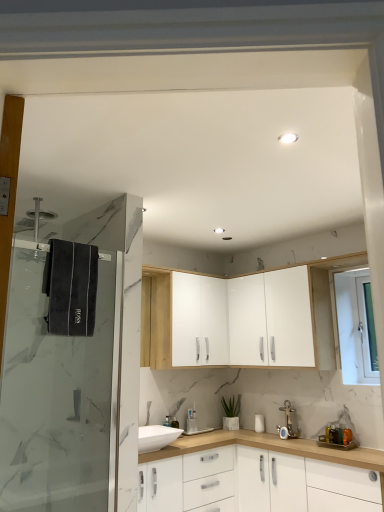
What is the approximate height of white plastic window screen at upper right?

The height of white plastic window screen at upper right is 32.03 inches.

At what (x,y) coordinates should I click in order to perform the action: click on white plastic window screen at upper right. Please return your answer as a coordinate pair (x, y). Image resolution: width=384 pixels, height=512 pixels. Looking at the image, I should click on (367, 328).

I want to click on dark grey towel at left, so click(71, 288).

This screenshot has width=384, height=512. What do you see at coordinates (71, 288) in the screenshot?
I see `dark grey towel at left` at bounding box center [71, 288].

Identify the location of white glossy light fixture at upper center. (288, 138).

Identify the location of white matte cabinet at center, which is counted as the first cabinetry, starting from the bottom. The height and width of the screenshot is (512, 384). (309, 474).

What do you see at coordinates (231, 406) in the screenshot?
I see `green matte plant at lower center` at bounding box center [231, 406].

I want to click on white plastic window screen at upper right, so click(367, 328).

Can you confirm if white glossy light fixture at upper center is bigger than dark grey towel at left?

No.

From a real-world perspective, is white glossy light fixture at upper center physically below dark grey towel at left?

No, from a real-world perspective, white glossy light fixture at upper center is not below dark grey towel at left.

Considering their positions, is white glossy light fixture at upper center located in front of or behind dark grey towel at left?

white glossy light fixture at upper center is in front of dark grey towel at left.

From the image's perspective, between transparent glass shower door at left and white glossy light fixture at upper center, which one is located above?

From the image's view, white glossy light fixture at upper center is above.

Considering the positions of point (131, 253) and point (284, 139), is point (131, 253) closer or farther from the camera than point (284, 139)?

Point (131, 253) is farther from the camera than point (284, 139).

Are transparent glass shower door at left and white glossy light fixture at upper center far apart?

Indeed, transparent glass shower door at left is not near white glossy light fixture at upper center.

How many degrees apart are the facing directions of transparent glass shower door at left and white glossy light fixture at upper center?

The facing directions of transparent glass shower door at left and white glossy light fixture at upper center are 176 degrees apart.

Does white glossy cabinet at center, the 1th cabinetry in the top-to-bottom sequence, have a lesser width compared to white glossy cabinet at upper center, positioned as the 2th cabinetry in top-to-bottom order?

In fact, white glossy cabinet at center, the 1th cabinetry in the top-to-bottom sequence, might be wider than white glossy cabinet at upper center, positioned as the 2th cabinetry in top-to-bottom order.

Is white glossy cabinet at center, the 1th cabinetry in the top-to-bottom sequence, positioned beyond the bounds of white glossy cabinet at upper center, positioned as the 2th cabinetry in top-to-bottom order?

Yes.

Is point (296, 306) farther from camera compared to point (223, 282)?

No, (296, 306) is closer to viewer.

Considering the relative sizes of white glossy cabinet at center, the 1th cabinetry in the top-to-bottom sequence, and white glossy cabinet at upper center, placed as the second cabinetry when sorted from bottom to top, in the image provided, is white glossy cabinet at center, the 1th cabinetry in the top-to-bottom sequence, shorter than white glossy cabinet at upper center, placed as the second cabinetry when sorted from bottom to top,?

Yes, white glossy cabinet at center, the 1th cabinetry in the top-to-bottom sequence, is shorter than white glossy cabinet at upper center, placed as the second cabinetry when sorted from bottom to top.

How many degrees apart are the facing directions of white matte cabinet at center, which is counted as the first cabinetry, starting from the bottom, and white plastic window screen at upper right?

0.0219 degrees separate the facing orientations of white matte cabinet at center, which is counted as the first cabinetry, starting from the bottom, and white plastic window screen at upper right.

Which is closer to the camera, (320, 487) or (372, 378)?

The point (320, 487) is more forward.

Considering the sizes of objects white matte cabinet at center, which is counted as the first cabinetry, starting from the bottom, and white plastic window screen at upper right in the image provided, who is taller, white matte cabinet at center, which is counted as the first cabinetry, starting from the bottom, or white plastic window screen at upper right?

white plastic window screen at upper right.

From a real-world perspective, between white matte cabinet at center, acting as the 3th cabinetry starting from the top, and white plastic window screen at upper right, who is vertically lower?

white matte cabinet at center, acting as the 3th cabinetry starting from the top, from a real-world perspective.

Based on the photo, between gold metallic faucet at lower right and white glossy cabinet at center, which is the 3th cabinetry in bottom-to-top order, which one appears on the left side from the viewer's perspective?

From the viewer's perspective, white glossy cabinet at center, which is the 3th cabinetry in bottom-to-top order, appears more on the left side.

Based on the photo, is gold metallic faucet at lower right positioned with its back to white glossy cabinet at center, which is the 3th cabinetry in bottom-to-top order?

No, white glossy cabinet at center, which is the 3th cabinetry in bottom-to-top order, is not at the back of gold metallic faucet at lower right.

Between gold metallic faucet at lower right and white glossy cabinet at center, which is the 3th cabinetry in bottom-to-top order, which one has smaller size?

gold metallic faucet at lower right.

Would you say gold metallic faucet at lower right is a long distance from white glossy cabinet at center, the 1th cabinetry in the top-to-bottom sequence?

gold metallic faucet at lower right is near white glossy cabinet at center, the 1th cabinetry in the top-to-bottom sequence, not far away.

From the image's perspective, which one is positioned higher, white glossy door at upper right or white matte cabinet at center, which is counted as the first cabinetry, starting from the bottom?

white glossy door at upper right is shown above in the image.

Does white glossy door at upper right have a greater height compared to white matte cabinet at center, acting as the 3th cabinetry starting from the top?

Yes.

Considering the positions of objects white glossy door at upper right and white matte cabinet at center, which is counted as the first cabinetry, starting from the bottom, in the image provided, who is more to the right, white glossy door at upper right or white matte cabinet at center, which is counted as the first cabinetry, starting from the bottom,?

white glossy door at upper right is more to the right.

Does white glossy door at upper right turn towards white matte cabinet at center, which is counted as the first cabinetry, starting from the bottom?

No.

From a real-world perspective, which object rests below the other?

In real-world perspective, white matte cabinet at center, acting as the 3th cabinetry starting from the top, is lower.

Is white glossy light fixture at upper center inside white matte cabinet at center, acting as the 3th cabinetry starting from the top?

Definitely not — white glossy light fixture at upper center is not inside white matte cabinet at center, acting as the 3th cabinetry starting from the top.

At what (x,y) coordinates should I click in order to perform the action: click on light fixture on the right of dark grey towel at left. Please return your answer as a coordinate pair (x, y). The width and height of the screenshot is (384, 512). Looking at the image, I should click on (288, 138).

Identify the location of light fixture behind the transparent glass shower door at left. This screenshot has height=512, width=384. (288, 138).

Which object lies further to the anchor point white glossy cabinet at upper center, placed as the second cabinetry when sorted from bottom to top, white glossy light fixture at upper center or white glossy door at upper right?

The object further to white glossy cabinet at upper center, placed as the second cabinetry when sorted from bottom to top, is white glossy light fixture at upper center.

Looking at the image, which one is located closer to white glossy door at upper right, dark grey towel at left or white plastic window screen at upper right?

Based on the image, white plastic window screen at upper right appears to be nearer to white glossy door at upper right.

Considering their positions, is white matte cabinet at center, which is counted as the first cabinetry, starting from the bottom, positioned closer to white plastic window screen at upper right than white glossy cabinet at center, which is the 3th cabinetry in bottom-to-top order?

Based on the image, white glossy cabinet at center, which is the 3th cabinetry in bottom-to-top order, appears to be nearer to white plastic window screen at upper right.

From the image, which object appears to be nearer to white matte cabinet at center, which is counted as the first cabinetry, starting from the bottom, gold metallic faucet at lower right or dark grey towel at left?

Among the two, gold metallic faucet at lower right is located nearer to white matte cabinet at center, which is counted as the first cabinetry, starting from the bottom.

From the image, which object appears to be farther from dark grey towel at left, transparent glass shower door at left or white glossy cabinet at center, which is the 3th cabinetry in bottom-to-top order?

white glossy cabinet at center, which is the 3th cabinetry in bottom-to-top order, is positioned further to the anchor dark grey towel at left.

Consider the image. Based on their spatial positions, is white plastic window screen at upper right or white glossy cabinet at upper center, positioned as the 2th cabinetry in top-to-bottom order, further from white matte cabinet at center, which is counted as the first cabinetry, starting from the bottom?

white plastic window screen at upper right lies further to white matte cabinet at center, which is counted as the first cabinetry, starting from the bottom, than the other object.

Consider the image. Looking at the image, which one is located further to dark grey towel at left, transparent glass shower door at left or gold metallic faucet at lower right?

gold metallic faucet at lower right is positioned further to the anchor dark grey towel at left.

Considering their positions, is white glossy cabinet at center, which is the 3th cabinetry in bottom-to-top order, positioned closer to white glossy light fixture at upper center than gold metallic faucet at lower right?

The object closer to white glossy light fixture at upper center is white glossy cabinet at center, which is the 3th cabinetry in bottom-to-top order.

Locate an element on the screen. The height and width of the screenshot is (512, 384). tap between white glossy door at upper right and white matte cabinet at center, which is counted as the first cabinetry, starting from the bottom, vertically is located at coordinates (290, 420).

At what (x,y) coordinates should I click in order to perform the action: click on material located between transparent glass shower door at left and white plastic window screen at upper right in the left-right direction. Please return your answer as a coordinate pair (x, y). This screenshot has width=384, height=512. Looking at the image, I should click on (71, 288).

Where is `window screen between white glossy cabinet at center, which is the 3th cabinetry in bottom-to-top order, and white matte cabinet at center, which is counted as the first cabinetry, starting from the bottom, from top to bottom`? The height and width of the screenshot is (512, 384). window screen between white glossy cabinet at center, which is the 3th cabinetry in bottom-to-top order, and white matte cabinet at center, which is counted as the first cabinetry, starting from the bottom, from top to bottom is located at coordinates (367, 328).

I want to click on window between white glossy cabinet at center, which is the 3th cabinetry in bottom-to-top order, and gold metallic faucet at lower right from top to bottom, so pos(356,328).